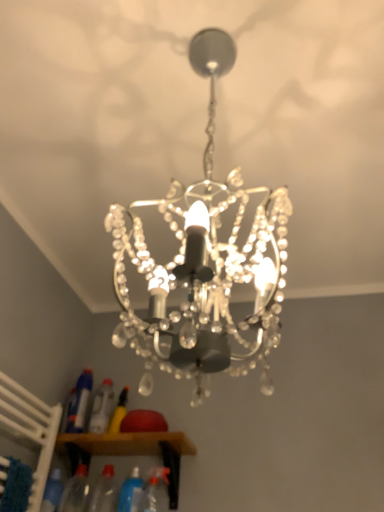
Question: From a real-world perspective, is wooden cabinet at lower center above or below transparent plastic bottle at lower center, the 3th bottle positioned from the right?

Choices:
 (A) above
 (B) below

Answer: (A)

Question: Considering the positions of point [x=175, y=433] and point [x=89, y=506], is point [x=175, y=433] closer or farther from the camera than point [x=89, y=506]?

Choices:
 (A) closer
 (B) farther

Answer: (B)

Question: Considering the real-world distances, which object is closest to the clear plastic bottle at lower left, which is the 3th bottle in left-to-right order?

Choices:
 (A) translucent plastic bottle at lower center, which is the first bottle from right to left
 (B) translucent plastic spray bottle at lower left, positioned as the first bottle in left-to-right order
 (C) transparent plastic bottle at lower left, which is the 2th bottle in left-to-right order
 (D) blue translucent bottle at lower center, the second bottle from the right
 (E) clear crystal chandelier at center

Answer: (B)

Question: Based on their relative distances, which object is farther from the transparent plastic bottle at lower center, the 3th bottle positioned from the right?

Choices:
 (A) clear crystal chandelier at center
 (B) wooden cabinet at lower center
 (C) blue translucent bottle at lower center, the second bottle from the right
 (D) transparent plastic bottle at lower left, the fifth bottle positioned from the right
 (E) translucent plastic bottle at lower center, which is the first bottle from right to left

Answer: (A)